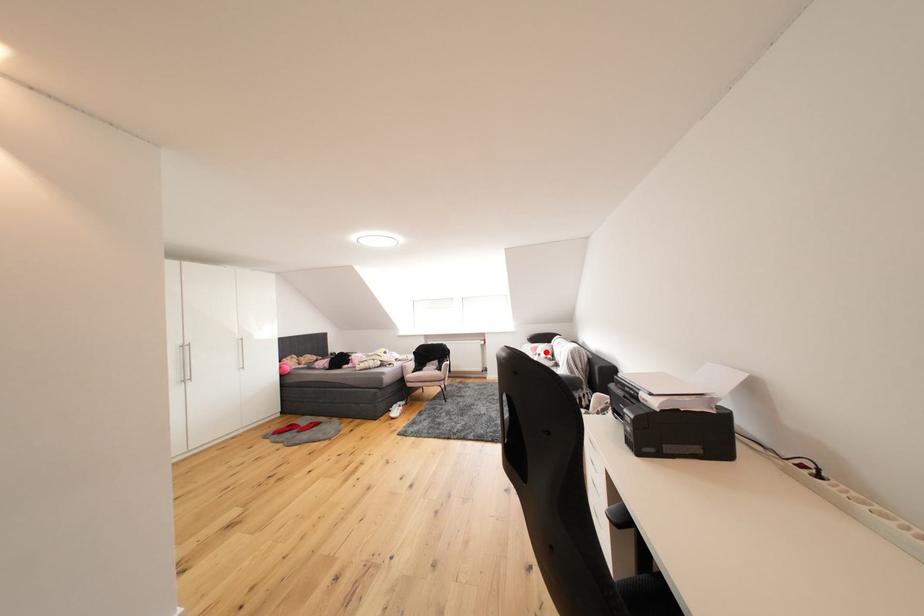
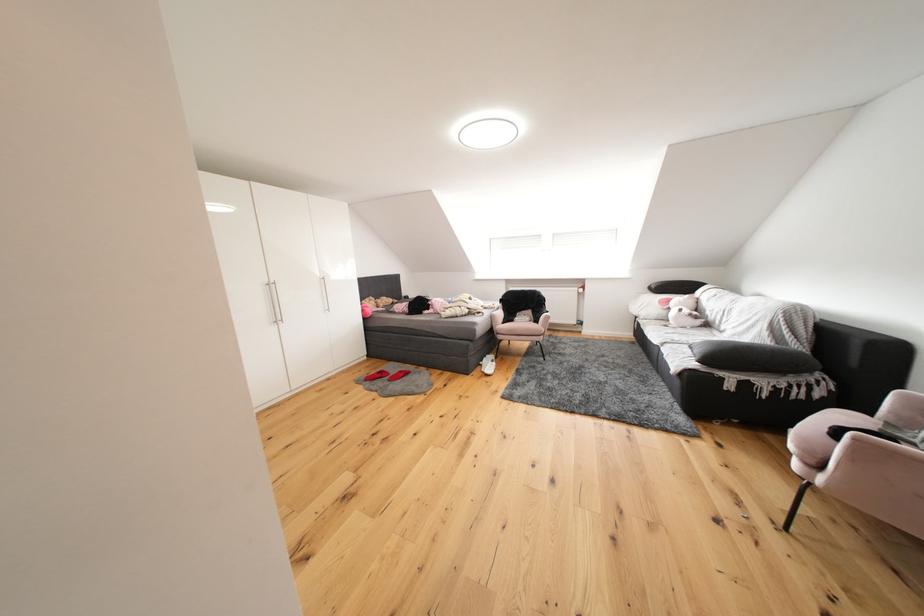
Question: I am providing you with two images of the same scene from different viewpoints. In image1, a red point is highlighted. Considering the same 3D point in image2, which of the following is correct?

Choices:
 (A) It is closer
 (B) It is farther

Answer: (A)